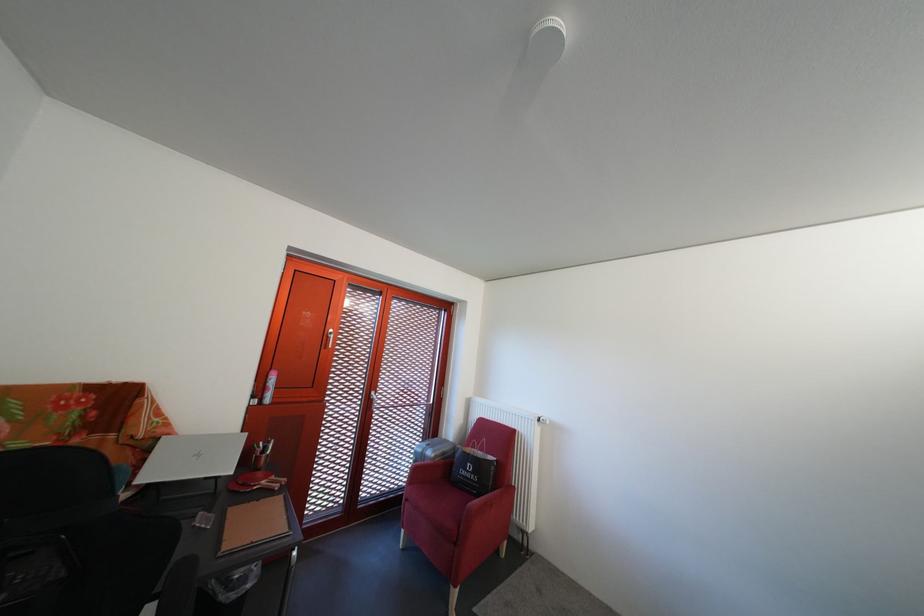
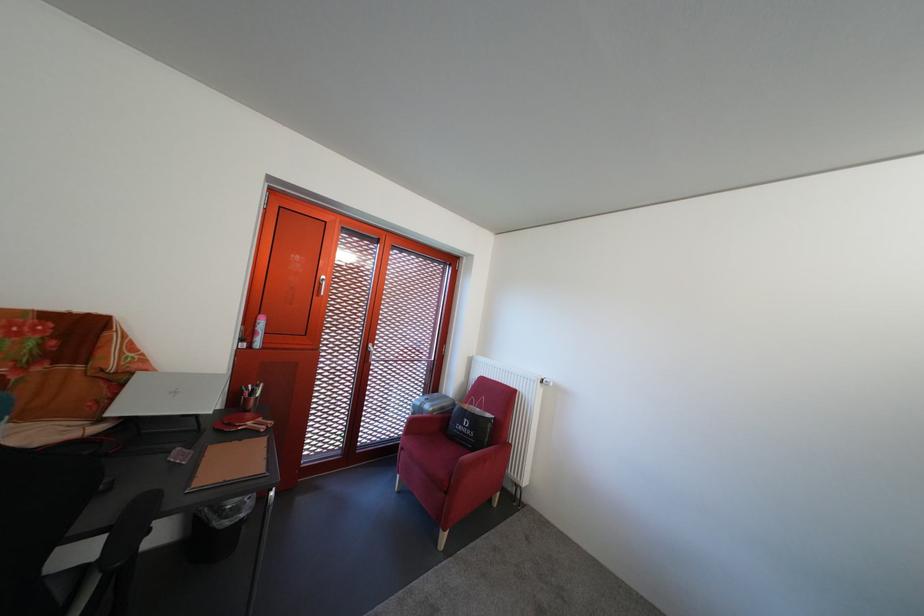
Locate, in the second image, the point that corresponds to pixel 418 507 in the first image.

(412, 456)